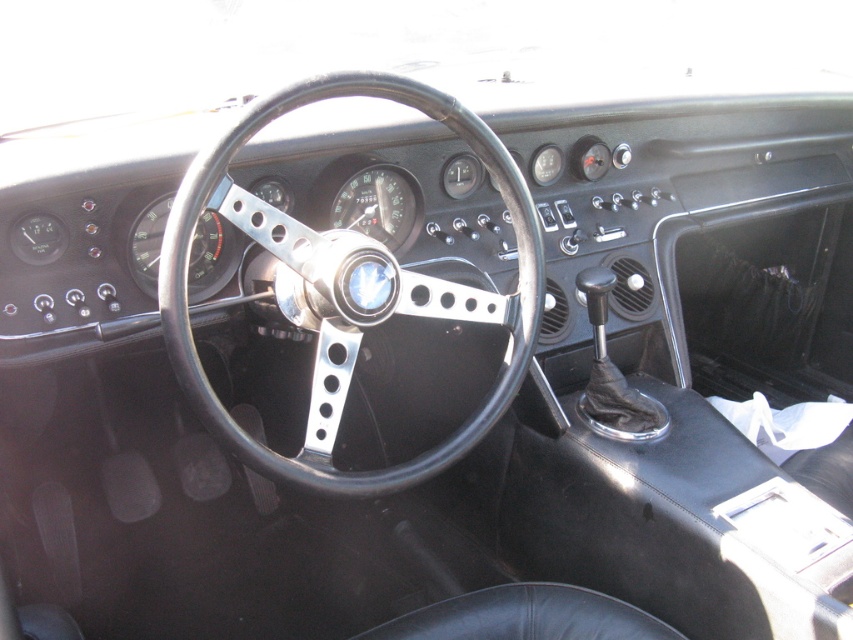
You are sitting in the driver seat of the vintage car. You notice a point marked at coordinates (349, 285) on the dashboard. What object is located at that point?

The point at coordinates (349, 285) marks the black leather steering wheel at center.

You are sitting in the driver seat of the vintage car and want to adjust the seat position. Which direction should you move the black leather seat at lower center to bring it closer to the black leather steering wheel at center?

You should move the black leather seat at lower center to the left to bring it closer to the black leather steering wheel at center since the steering wheel is to the left of the seat.

You are sitting in the driver seat of the vintage car shown. The steering wheel is at center. Where exactly is the black leather steering wheel at center located in terms of coordinates?

The black leather steering wheel at center is located at coordinates point (x=349, y=285).